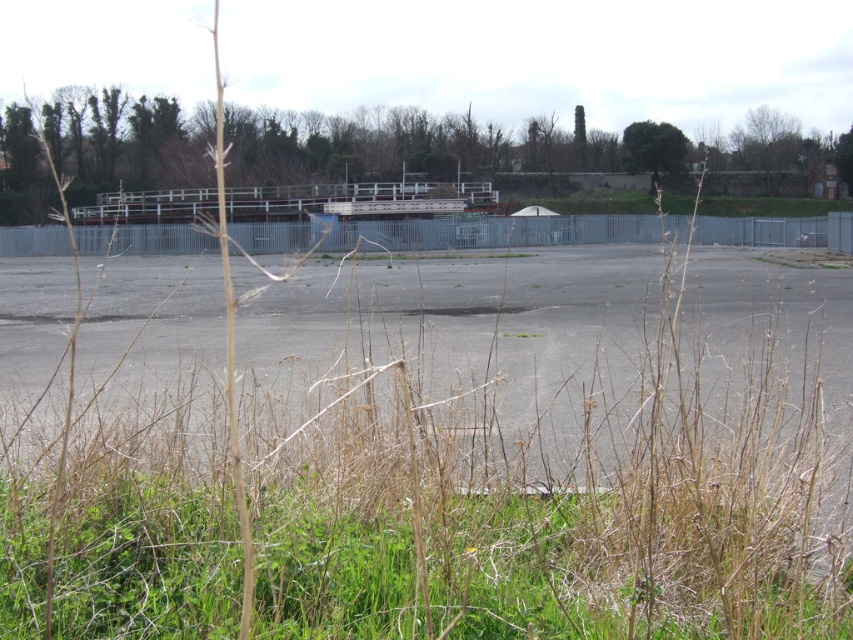
Question: Is green grass at lower center bigger than gray asphalt parking lot at center?

Choices:
 (A) no
 (B) yes

Answer: (A)

Question: Where is green grass at lower center located in relation to gray asphalt parking lot at center in the image?

Choices:
 (A) above
 (B) below

Answer: (B)

Question: Is green grass at lower center in front of gray asphalt parking lot at center?

Choices:
 (A) yes
 (B) no

Answer: (A)